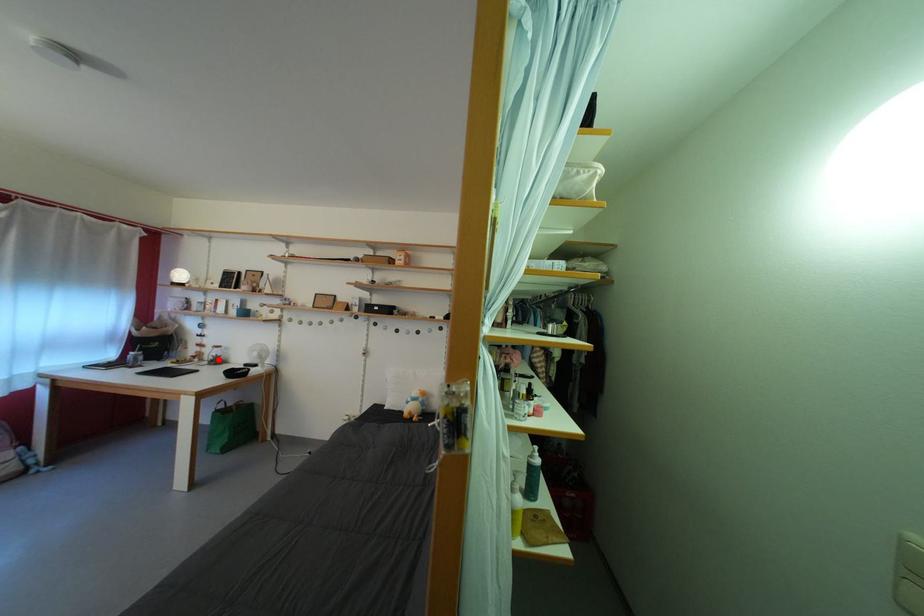
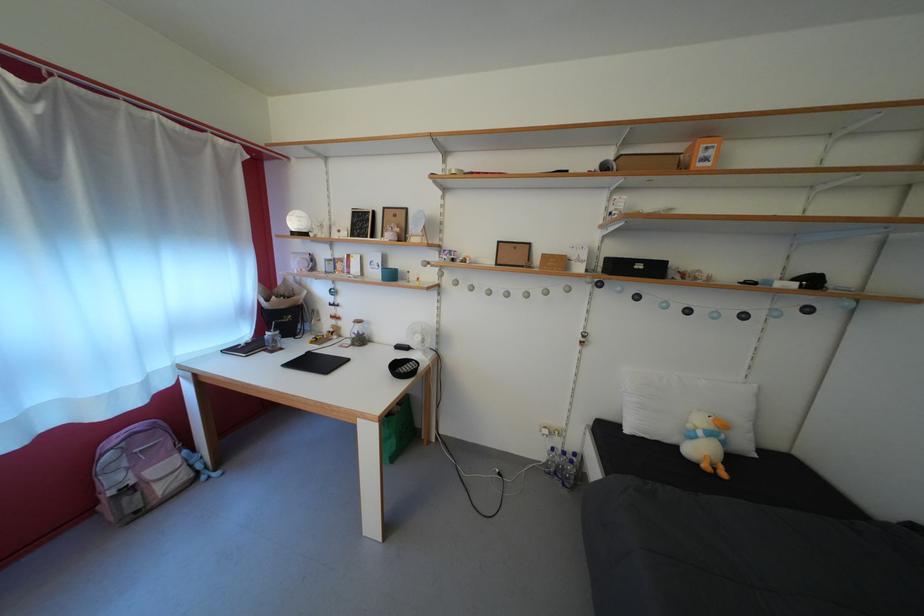
Locate, in the second image, the point that corresponds to the highlighted location in the first image.

(358, 334)